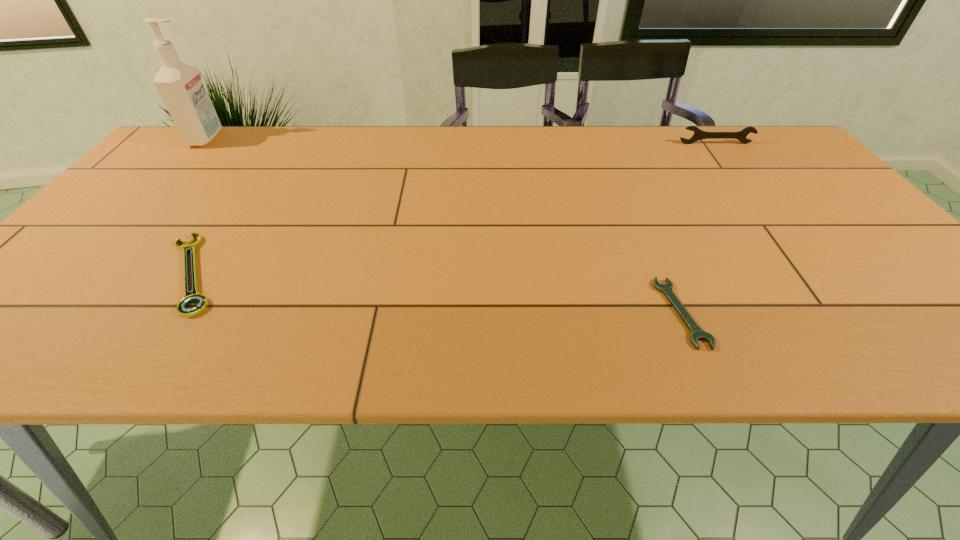
This screenshot has width=960, height=540. Find the location of `empty location between the second object from left to right and the rightmost wrench`. empty location between the second object from left to right and the rightmost wrench is located at coordinates (454, 208).

You are a GUI agent. You are given a task and a screenshot of the screen. Output one action in this format:
    pyautogui.click(x=<x>, y=<y>)
    Task: Click on the free spot between the tallest object and the second wrench from right to left
    Image resolution: width=960 pixels, height=540 pixels.
    Given the screenshot: What is the action you would take?
    pyautogui.click(x=444, y=225)

You are a GUI agent. You are given a task and a screenshot of the screen. Output one action in this format:
    pyautogui.click(x=<x>, y=<y>)
    Task: Click on the vacant point located between the second object from left to right and the rightmost wrench
    This screenshot has height=540, width=960.
    Given the screenshot: What is the action you would take?
    pos(454,208)

Identify the location of free space between the tallest wrench and the second object from right to left. The height and width of the screenshot is (540, 960). (698, 228).

Image resolution: width=960 pixels, height=540 pixels. Find the location of `free space between the third object from right to left and the second object from right to left`. free space between the third object from right to left and the second object from right to left is located at coordinates (437, 293).

Where is `vacant space that's between the leftmost wrench and the tallest wrench`? vacant space that's between the leftmost wrench and the tallest wrench is located at coordinates (454, 208).

Identify the location of blank region between the leftmost wrench and the second wrench from right to left. The height and width of the screenshot is (540, 960). (437, 293).

Locate an element on the screen. The width and height of the screenshot is (960, 540). free space between the second object from right to left and the leftmost wrench is located at coordinates (437, 293).

Find the location of a particular element. empty location between the leftmost wrench and the second wrench from left to right is located at coordinates (437, 293).

Where is `vacant area between the tallest object and the second wrench from left to right`? The image size is (960, 540). vacant area between the tallest object and the second wrench from left to right is located at coordinates (444, 225).